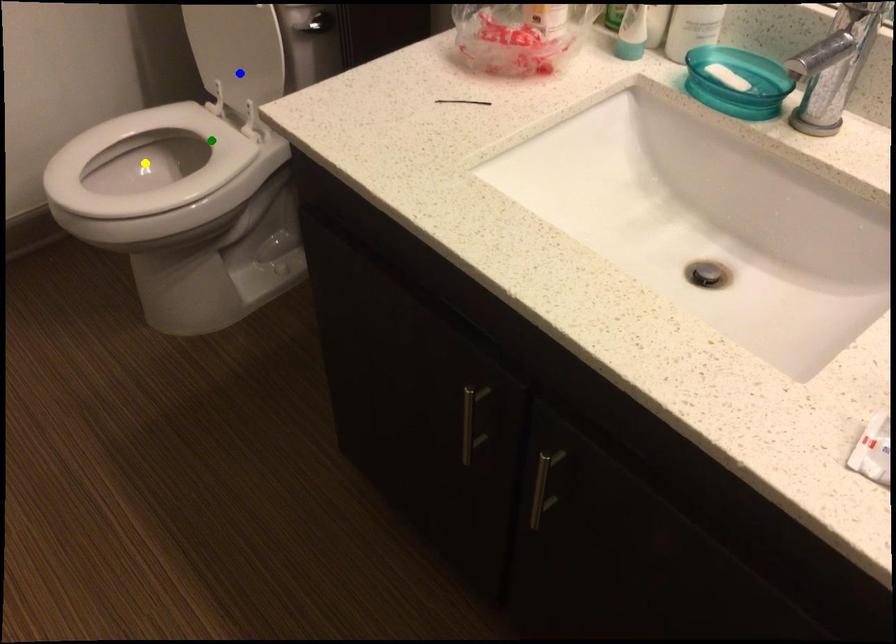
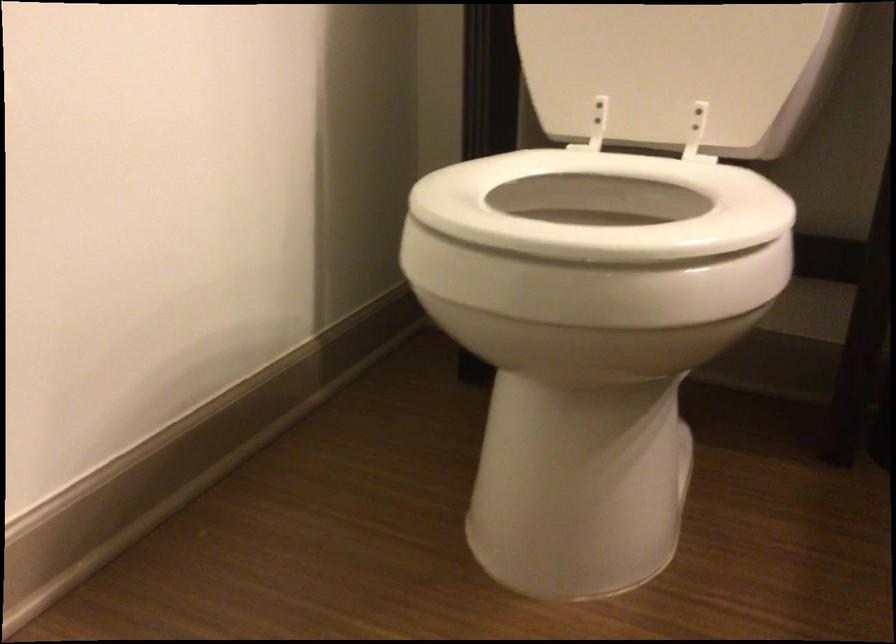
I am providing you with two images of the same scene from different viewpoints. Three points are marked in image1. Which point corresponds to a part or object that is occluded in image2?In image1, three points are marked. Which of them correspond to a part or object that is occluded in image2?Among the three points shown in image1, which one corresponds to a part or object that is no longer visible due to occlusion in image2?

yellow point